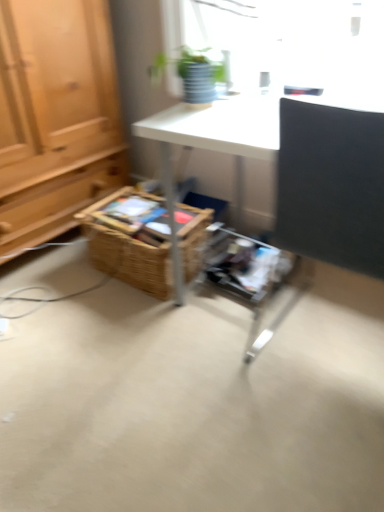
This screenshot has height=512, width=384. Describe the element at coordinates (192, 73) in the screenshot. I see `green matte plant at upper center` at that location.

Where is `matte black desk at right`? matte black desk at right is located at coordinates (299, 166).

I want to click on desk that is below the green matte plant at upper center (from the image's perspective), so click(x=299, y=166).

How different are the orientations of matte black desk at right and green matte plant at upper center in degrees?

The angular difference between matte black desk at right and green matte plant at upper center is 176 degrees.

Consider the image. Which object is further away from the camera, matte black desk at right or green matte plant at upper center?

green matte plant at upper center is behind.

From a real-world perspective, between woven brown basket at center and matte black desk at right, who is vertically lower?

From a 3D spatial view, woven brown basket at center is below.

Considering the positions of point (134, 276) and point (302, 205), is point (134, 276) closer or farther from the camera than point (302, 205)?

Point (134, 276) appears to be farther away from the viewer than point (302, 205).

Is woven brown basket at center far away from matte black desk at right?

No, woven brown basket at center is not far from matte black desk at right.

Is woven brown basket at center at the back of matte black desk at right?

That's not correct — matte black desk at right is not looking away from woven brown basket at center.

Considering the sizes of objects matte black desk at right and woven brown basket at center in the image provided, who is shorter, matte black desk at right or woven brown basket at center?

woven brown basket at center is shorter.

From a real-world perspective, is matte black desk at right under woven brown basket at center?

Incorrect, from a real-world perspective, matte black desk at right is higher than woven brown basket at center.

From the image's perspective, is matte black desk at right above woven brown basket at center?

No, from the image's perspective, matte black desk at right is not over woven brown basket at center.

Between point (187, 90) and point (121, 247), which one is positioned in front?

The point (187, 90) is closer to the camera.

Is green matte plant at upper center further to the viewer compared to woven brown basket at center?

No, green matte plant at upper center is closer to the viewer.

Can you confirm if green matte plant at upper center is taller than woven brown basket at center?

In fact, green matte plant at upper center may be shorter than woven brown basket at center.

Is green matte plant at upper center to the right of woven brown basket at center from the viewer's perspective?

Correct, you'll find green matte plant at upper center to the right of woven brown basket at center.

Which object is wider, green matte plant at upper center or matte black desk at right?

With larger width is matte black desk at right.

Based on the photo, from a real-world perspective, who is located lower, green matte plant at upper center or matte black desk at right?

From a 3D spatial view, matte black desk at right is below.

Is the position of green matte plant at upper center less distant than that of matte black desk at right?

No, the depth of green matte plant at upper center is greater than that of matte black desk at right.

Visually, is green matte plant at upper center positioned to the left or to the right of matte black desk at right?

green matte plant at upper center is positioned on matte black desk at right's left side.

Is woven brown basket at center thinner than green matte plant at upper center?

Incorrect, the width of woven brown basket at center is not less than that of green matte plant at upper center.

Between woven brown basket at center and green matte plant at upper center, which one appears on the right side from the viewer's perspective?

Positioned to the right is green matte plant at upper center.

Is woven brown basket at center bigger than green matte plant at upper center?

Correct, woven brown basket at center is larger in size than green matte plant at upper center.

From a real-world perspective, is woven brown basket at center located higher than green matte plant at upper center?

Actually, woven brown basket at center is physically below green matte plant at upper center in the real world.

Find the location of a particular element. desk below the green matte plant at upper center (from the image's perspective) is located at coordinates (299, 166).

This screenshot has width=384, height=512. Find the location of `desk in front of the woven brown basket at center`. desk in front of the woven brown basket at center is located at coordinates (299, 166).

From the image, which object appears to be farther from matte black desk at right, woven brown basket at center or green matte plant at upper center?

The object further to matte black desk at right is woven brown basket at center.

Which object lies nearer to the anchor point woven brown basket at center, green matte plant at upper center or matte black desk at right?

matte black desk at right is positioned closer to the anchor woven brown basket at center.

When comparing their distances from matte black desk at right, does green matte plant at upper center or woven brown basket at center seem closer?

The object closer to matte black desk at right is green matte plant at upper center.

Considering their positions, is woven brown basket at center positioned closer to green matte plant at upper center than matte black desk at right?

matte black desk at right is closer to green matte plant at upper center.

Which object lies further to the anchor point green matte plant at upper center, matte black desk at right or woven brown basket at center?

Based on the image, woven brown basket at center appears to be further to green matte plant at upper center.

Based on the photo, when comparing their distances from woven brown basket at center, does matte black desk at right or green matte plant at upper center seem closer?

Among the two, matte black desk at right is located nearer to woven brown basket at center.

Image resolution: width=384 pixels, height=512 pixels. I want to click on houseplant between matte black desk at right and woven brown basket at center along the z-axis, so click(x=192, y=73).